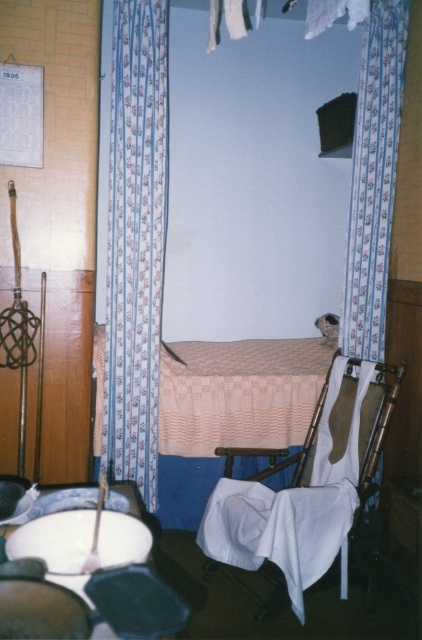
Question: Observing the image, what is the correct spatial positioning of wooden rocking chair at center in reference to white glossy table at lower left?

Choices:
 (A) above
 (B) below

Answer: (B)

Question: Which object appears farthest from the camera in this image?

Choices:
 (A) floral fabric curtain at right
 (B) white glossy table at lower left
 (C) beige woven blanket at center

Answer: (C)

Question: Among these points, which one is farthest from the camera?

Choices:
 (A) (273, 492)
 (B) (397, 115)
 (C) (140, 573)
 (D) (135, 356)

Answer: (B)

Question: Can you confirm if floral fabric curtain at left is thinner than white glossy table at lower left?

Choices:
 (A) no
 (B) yes

Answer: (A)

Question: Is floral fabric curtain at left thinner than beige woven blanket at center?

Choices:
 (A) no
 (B) yes

Answer: (B)

Question: Which of these objects is positioned farthest from the floral fabric curtain at left?

Choices:
 (A) wooden rocking chair at center
 (B) white glossy table at lower left
 (C) beige woven blanket at center

Answer: (B)